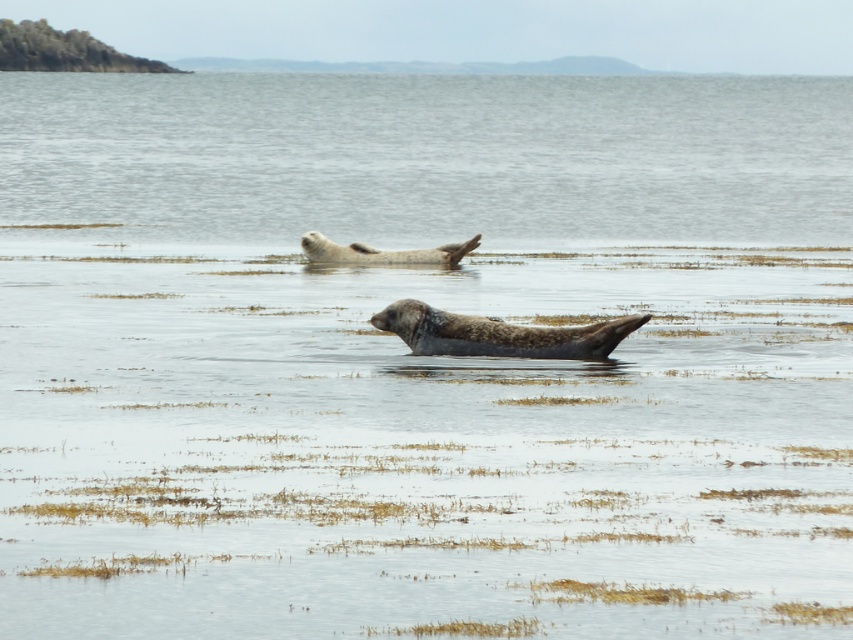
Question: Which of the following is the farthest from the observer?

Choices:
 (A) gray fur seal at center
 (B) speckled fur seal at center

Answer: (A)

Question: Does speckled fur seal at center have a smaller size compared to gray fur seal at center?

Choices:
 (A) no
 (B) yes

Answer: (A)

Question: Is speckled fur seal at center above gray fur seal at center?

Choices:
 (A) no
 (B) yes

Answer: (A)

Question: Is speckled fur seal at center thinner than gray fur seal at center?

Choices:
 (A) yes
 (B) no

Answer: (A)

Question: Which point is closer to the camera taking this photo?

Choices:
 (A) 410,260
 (B) 387,324

Answer: (B)